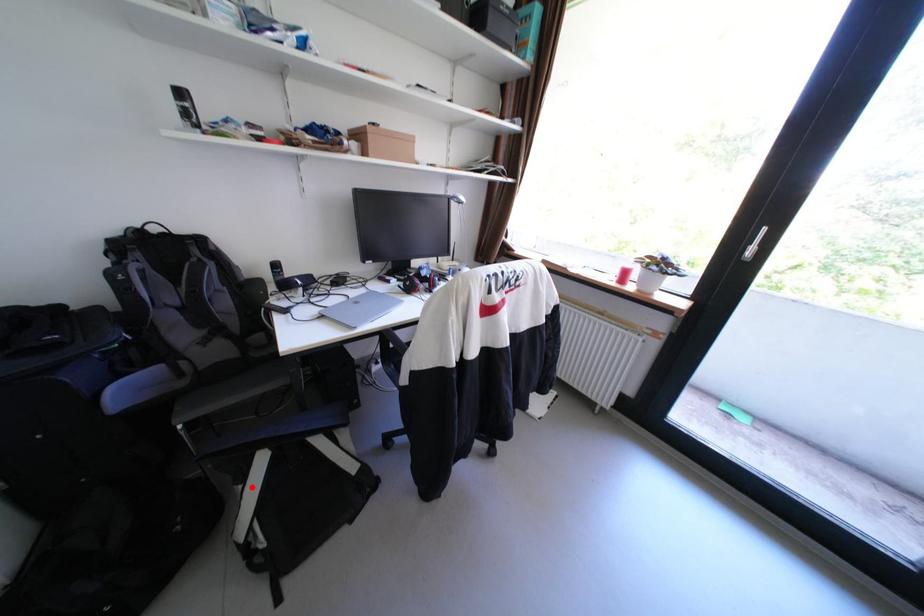
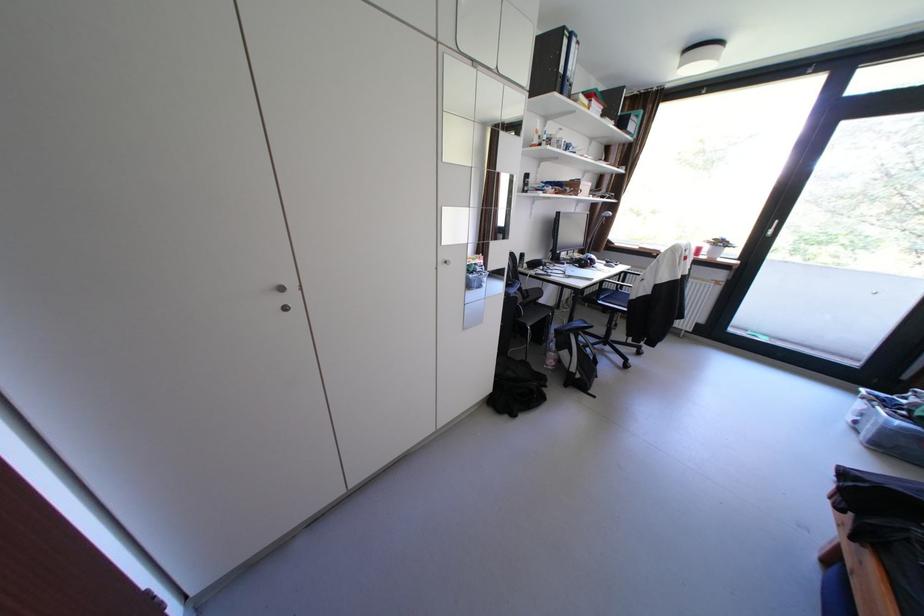
Locate, in the second image, the point that corresponds to the highlighted location in the first image.

(578, 351)